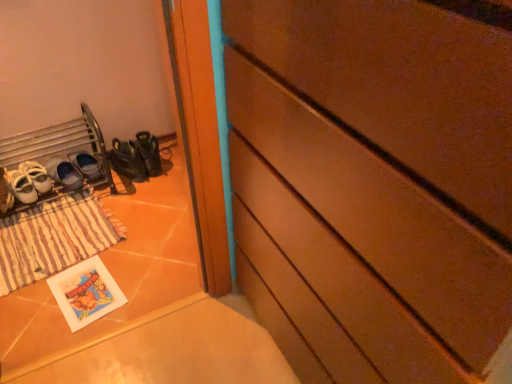
The image size is (512, 384). Find the location of `unoccupied region to the right of white leather shoes at left, positioned as the 2th footwear in right-to-left order`. unoccupied region to the right of white leather shoes at left, positioned as the 2th footwear in right-to-left order is located at coordinates (147, 202).